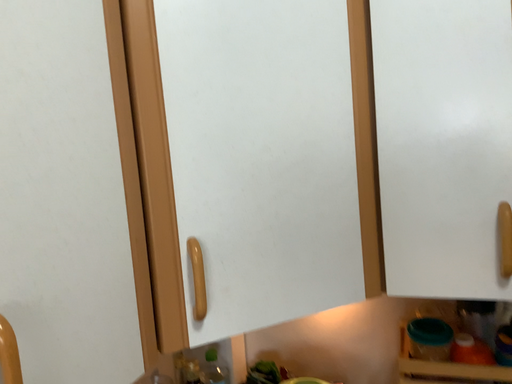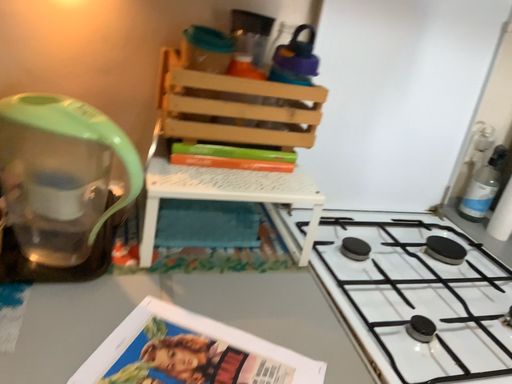
Question: Which way did the camera rotate in the video?

Choices:
 (A) rotated right
 (B) rotated left

Answer: (A)